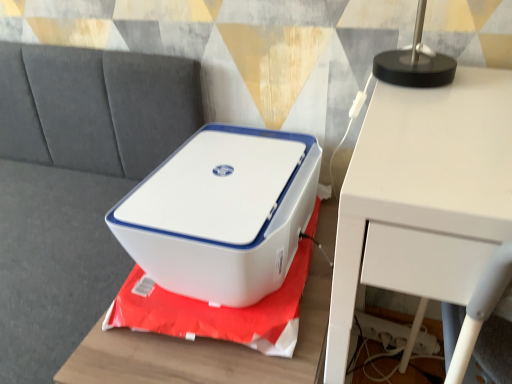
Question: From a real-world perspective, does white plastic printer at center sit lower than white matte table at upper right?

Choices:
 (A) yes
 (B) no

Answer: (A)

Question: Is white plastic printer at center outside white matte table at upper right?

Choices:
 (A) yes
 (B) no

Answer: (A)

Question: Considering the relative sizes of white plastic printer at center and white matte table at upper right in the image provided, is white plastic printer at center shorter than white matte table at upper right?

Choices:
 (A) yes
 (B) no

Answer: (A)

Question: Are white plastic printer at center and white matte table at upper right making contact?

Choices:
 (A) no
 (B) yes

Answer: (A)

Question: Is white matte table at upper right inside white plastic printer at center?

Choices:
 (A) yes
 (B) no

Answer: (B)

Question: Does point (123, 258) appear closer or farther from the camera than point (502, 110)?

Choices:
 (A) closer
 (B) farther

Answer: (B)

Question: From a real-world perspective, is gray fabric couch at upper left physically located above or below white matte table at upper right?

Choices:
 (A) above
 (B) below

Answer: (B)

Question: In the image, is gray fabric couch at upper left positioned in front of or behind white matte table at upper right?

Choices:
 (A) front
 (B) behind

Answer: (B)

Question: From the image's perspective, relative to white matte table at upper right, is gray fabric couch at upper left above or below?

Choices:
 (A) above
 (B) below

Answer: (A)

Question: In terms of height, does white matte table at upper right look taller or shorter compared to white plastic printer at center?

Choices:
 (A) short
 (B) tall

Answer: (B)

Question: Does point (483, 132) appear closer or farther from the camera than point (143, 344)?

Choices:
 (A) farther
 (B) closer

Answer: (B)

Question: Based on their positions, is white matte table at upper right located to the left or right of white plastic printer at center?

Choices:
 (A) right
 (B) left

Answer: (A)

Question: From a real-world perspective, is white matte table at upper right positioned above or below white plastic printer at center?

Choices:
 (A) above
 (B) below

Answer: (A)

Question: From a real-world perspective, is white plastic printer at center positioned above or below gray fabric couch at upper left?

Choices:
 (A) below
 (B) above

Answer: (A)

Question: Considering their positions, is white plastic printer at center located in front of or behind gray fabric couch at upper left?

Choices:
 (A) behind
 (B) front

Answer: (A)